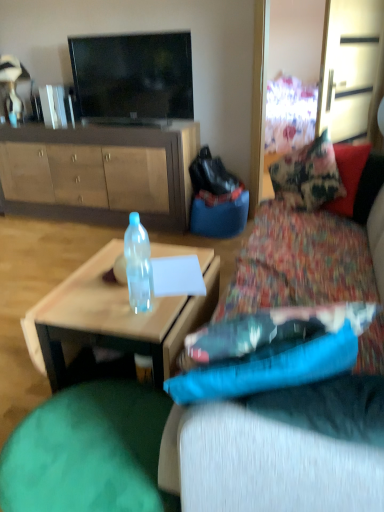
Describe the element at coordinates (133, 78) in the screenshot. I see `flat screen tv at upper center` at that location.

This screenshot has height=512, width=384. What do you see at coordinates (115, 315) in the screenshot?
I see `translucent plastic coffee table at center` at bounding box center [115, 315].

This screenshot has width=384, height=512. Describe the element at coordinates (192, 315) in the screenshot. I see `textured fabric couch at center` at that location.

Find the location of a particular element. matte brown cabinet at center is located at coordinates (100, 173).

Is textured fabric couch at center facing towards green fabric bean bag at lower left?

No, textured fabric couch at center is not facing towards green fabric bean bag at lower left.

Between textured fabric couch at center and green fabric bean bag at lower left, which one appears on the right side from the viewer's perspective?

textured fabric couch at center.

Considering the sizes of objects textured fabric couch at center and green fabric bean bag at lower left in the image provided, who is smaller, textured fabric couch at center or green fabric bean bag at lower left?

With smaller size is green fabric bean bag at lower left.

Locate an element on the screen. The width and height of the screenshot is (384, 512). studio couch in front of the flat screen tv at upper center is located at coordinates (192, 315).

Considering the positions of point (122, 48) and point (181, 316), is point (122, 48) closer or farther from the camera than point (181, 316)?

Point (122, 48).

Is the position of flat screen tv at upper center more distant than that of textured fabric couch at center?

Yes, flat screen tv at upper center is further from the viewer.

Considering the relative sizes of flat screen tv at upper center and textured fabric couch at center in the image provided, is flat screen tv at upper center wider than textured fabric couch at center?

No, flat screen tv at upper center is not wider than textured fabric couch at center.

In terms of size, does matte brown cabinet at center appear bigger or smaller than textured fabric couch at center?

Considering their sizes, matte brown cabinet at center takes up more space than textured fabric couch at center.

Is matte brown cabinet at center to the left or to the right of textured fabric couch at center in the image?

matte brown cabinet at center is to the left of textured fabric couch at center.

Considering the positions of points (1, 152) and (218, 448), is point (1, 152) farther from camera compared to point (218, 448)?

Yes, point (1, 152) is behind point (218, 448).

From a real-world perspective, is green fabric bean bag at lower left positioned under textured fabric couch at center based on gravity?

Yes.

Is green fabric bean bag at lower left oriented away from textured fabric couch at center?

No, green fabric bean bag at lower left is not facing the opposite direction of textured fabric couch at center.

Between green fabric bean bag at lower left and textured fabric couch at center, which one has more height?

With more height is textured fabric couch at center.

Is point (123, 449) positioned in front of point (177, 323)?

Yes, it is in front of point (177, 323).

Which point is more forward, (169, 245) or (113, 111)?

The point (169, 245) is in front.

Is translucent plastic coffee table at center situated inside flat screen tv at upper center or outside?

translucent plastic coffee table at center is not inside flat screen tv at upper center, it's outside.

In terms of width, does translucent plastic coffee table at center look wider or thinner when compared to flat screen tv at upper center?

In the image, translucent plastic coffee table at center appears to be wider than flat screen tv at upper center.

Considering the positions of objects translucent plastic coffee table at center and flat screen tv at upper center in the image provided, who is in front, translucent plastic coffee table at center or flat screen tv at upper center?

translucent plastic coffee table at center is in front.

In terms of size, does matte brown cabinet at center appear bigger or smaller than green fabric bean bag at lower left?

Clearly, matte brown cabinet at center is larger in size than green fabric bean bag at lower left.

Which object is closer to the camera, matte brown cabinet at center or green fabric bean bag at lower left?

green fabric bean bag at lower left.

Is matte brown cabinet at center oriented towards green fabric bean bag at lower left?

Yes, matte brown cabinet at center is turned towards green fabric bean bag at lower left.

In the scene shown: Can you see matte brown cabinet at center touching green fabric bean bag at lower left?

matte brown cabinet at center is not next to green fabric bean bag at lower left, and they're not touching.

How different are the orientations of textured fabric couch at center and translucent plastic coffee table at center in degrees?

The facing directions of textured fabric couch at center and translucent plastic coffee table at center are 67.4 degrees apart.

Identify the location of coffee table that appears below the textured fabric couch at center (from the image's perspective). Image resolution: width=384 pixels, height=512 pixels. (115, 315).

Can you confirm if textured fabric couch at center is shorter than translucent plastic coffee table at center?

No, textured fabric couch at center is not shorter than translucent plastic coffee table at center.

Where is `studio couch in front of the green fabric bean bag at lower left`? The height and width of the screenshot is (512, 384). studio couch in front of the green fabric bean bag at lower left is located at coordinates pos(192,315).

Image resolution: width=384 pixels, height=512 pixels. What are the coordinates of `studio couch lying below the flat screen tv at upper center (from the image's perspective)` in the screenshot? It's located at (192, 315).

Based on their spatial positions, is green fabric bean bag at lower left or flat screen tv at upper center closer to matte brown cabinet at center?

flat screen tv at upper center.

From the image, which object appears to be farther from green fabric bean bag at lower left, flat screen tv at upper center or textured fabric couch at center?

flat screen tv at upper center.

Which object lies nearer to the anchor point flat screen tv at upper center, textured fabric couch at center or green fabric bean bag at lower left?

green fabric bean bag at lower left.

Based on their spatial positions, is textured fabric couch at center or matte brown cabinet at center further from translucent plastic coffee table at center?

matte brown cabinet at center is further to translucent plastic coffee table at center.

When comparing their distances from flat screen tv at upper center, does textured fabric couch at center or translucent plastic coffee table at center seem closer?

translucent plastic coffee table at center lies closer to flat screen tv at upper center than the other object.

Estimate the real-world distances between objects in this image. Which object is closer to textured fabric couch at center, matte brown cabinet at center or green fabric bean bag at lower left?

green fabric bean bag at lower left.

Considering their positions, is green fabric bean bag at lower left positioned closer to translucent plastic coffee table at center than flat screen tv at upper center?

green fabric bean bag at lower left is closer to translucent plastic coffee table at center.

From the picture: Estimate the real-world distances between objects in this image. Which object is closer to translucent plastic coffee table at center, matte brown cabinet at center or flat screen tv at upper center?

matte brown cabinet at center.

Identify the location of coffee table between flat screen tv at upper center and green fabric bean bag at lower left in the vertical direction. (115, 315).

The image size is (384, 512). I want to click on coffee table located between textured fabric couch at center and flat screen tv at upper center in the depth direction, so click(x=115, y=315).

Locate an element on the screen. This screenshot has width=384, height=512. bean bag chair between textured fabric couch at center and translucent plastic coffee table at center along the z-axis is located at coordinates (88, 452).

This screenshot has height=512, width=384. I want to click on coffee table between green fabric bean bag at lower left and matte brown cabinet at center in the front-back direction, so click(115, 315).